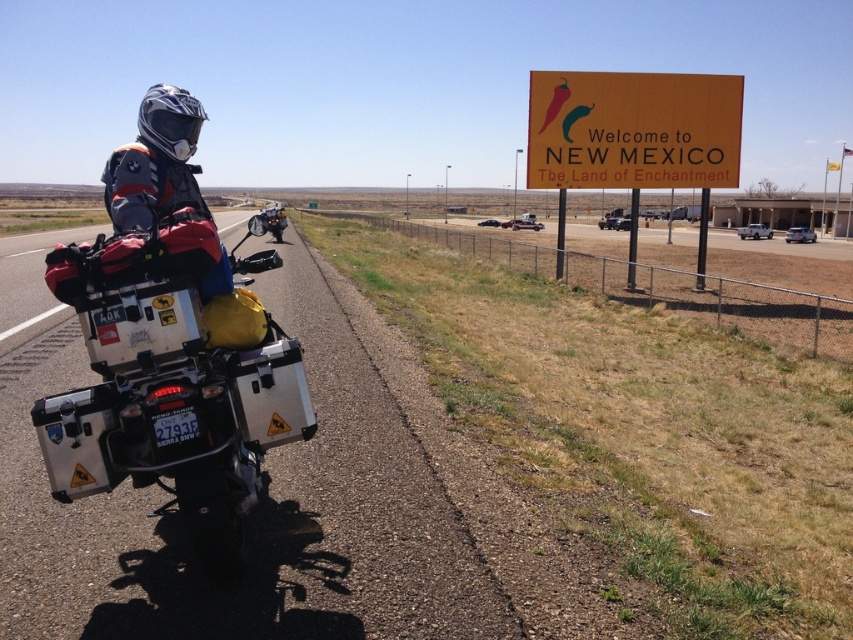
Question: Can you confirm if silver metallic motorcycle at left is positioned to the left of yellow matte sign at upper right?

Choices:
 (A) yes
 (B) no

Answer: (A)

Question: Is silver metallic motorcycle at left to the right of yellow matte sign at upper right from the viewer's perspective?

Choices:
 (A) no
 (B) yes

Answer: (A)

Question: Which point is farther to the camera?

Choices:
 (A) (282, 211)
 (B) (165, 285)

Answer: (A)

Question: Is the position of silver metallic motorcycle at left less distant than that of yellow matte sign at upper right?

Choices:
 (A) yes
 (B) no

Answer: (A)

Question: Which of the following is the closest to the observer?

Choices:
 (A) matte black motorcycle at center
 (B) yellow matte sign at upper right

Answer: (A)

Question: Which object is closer to the camera taking this photo?

Choices:
 (A) matte black motorcycle at center
 (B) yellow matte sign at upper right

Answer: (A)